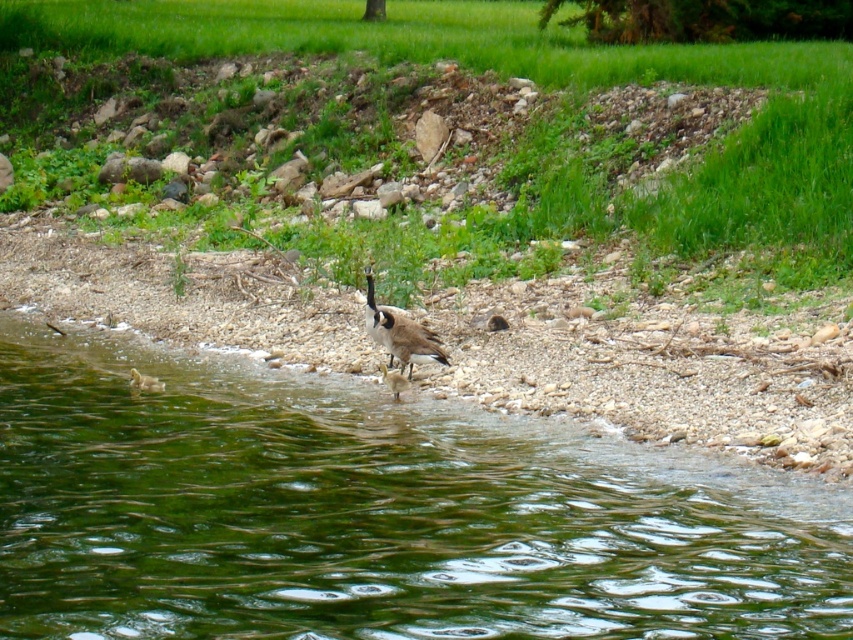
Question: Which is nearer to the brown speckled feathers at center?

Choices:
 (A) brown fuzzy duckling at center
 (B) green smooth water at lower left
 (C) brown fuzzy duckling at lower left

Answer: (A)

Question: Which of the following is the farthest from the observer?

Choices:
 (A) (849, 68)
 (B) (398, 330)

Answer: (A)

Question: Where is green smooth water at lower left located in relation to brown fuzzy duckling at lower left in the image?

Choices:
 (A) right
 (B) left

Answer: (A)

Question: Estimate the real-world distances between objects in this image. Which object is farther from the green smooth water at lower left?

Choices:
 (A) brown speckled feathers at center
 (B) brown fuzzy duckling at center
 (C) brown fuzzy duckling at lower left
 (D) green grass at upper center

Answer: (D)

Question: Is green smooth water at lower left smaller than green grass at upper center?

Choices:
 (A) yes
 (B) no

Answer: (A)

Question: Is green smooth water at lower left smaller than brown speckled feathers at center?

Choices:
 (A) yes
 (B) no

Answer: (A)